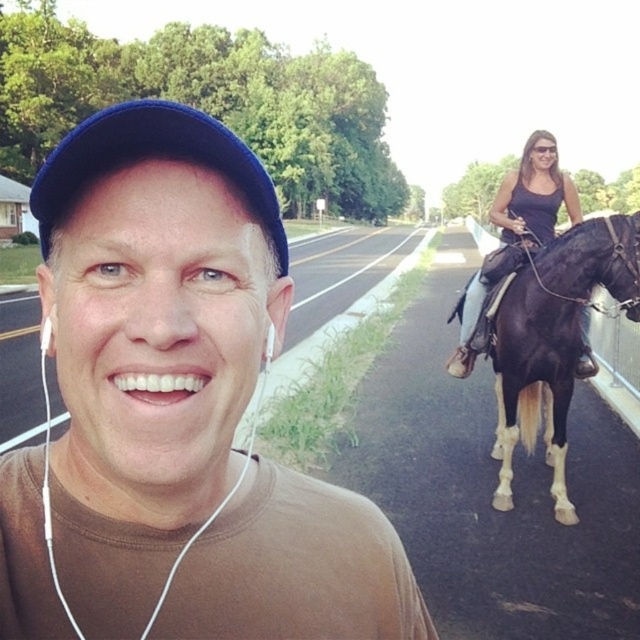
Question: Among these points, which one is farthest from the camera?

Choices:
 (A) (545, 145)
 (B) (38, 230)
 (C) (26, 600)
 (D) (500, 410)

Answer: (B)

Question: Which of the following is the farthest from the observer?

Choices:
 (A) coord(536,364)
 (B) coord(138,589)
 (C) coord(465,355)

Answer: (C)

Question: Considering the real-world distances, which object is closest to the black glossy horse at right?

Choices:
 (A) blue fabric baseball cap at upper center
 (B) brown matte t-shirt at center
 (C) black satin dress at upper right

Answer: (C)

Question: Is black glossy horse at right thinner than black satin dress at upper right?

Choices:
 (A) yes
 (B) no

Answer: (A)

Question: Considering the relative positions of brown matte t-shirt at center and blue fabric baseball cap at upper center in the image provided, where is brown matte t-shirt at center located with respect to blue fabric baseball cap at upper center?

Choices:
 (A) right
 (B) left

Answer: (A)

Question: Is brown matte t-shirt at center below blue fabric baseball cap at upper center?

Choices:
 (A) no
 (B) yes

Answer: (B)